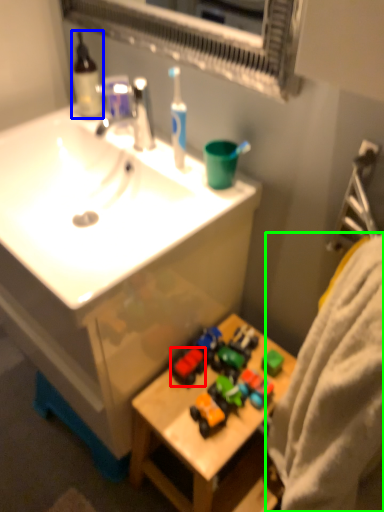
Question: Based on their relative distances, which object is farther from toy (highlighted by a red box)? Choose from bottle (highlighted by a blue box) and bath towel (highlighted by a green box).

Choices:
 (A) bottle
 (B) bath towel

Answer: (A)